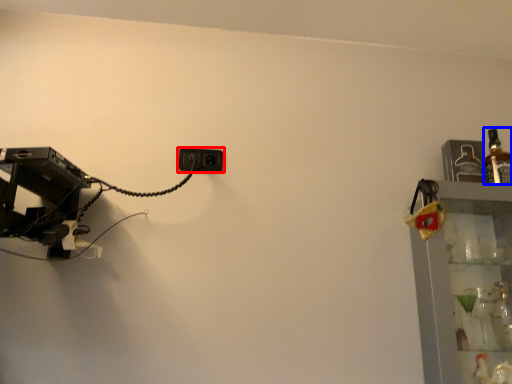
Question: Which point is closer to the camera, power plugs and sockets (highlighted by a red box) or bottle (highlighted by a blue box)?

Choices:
 (A) power plugs and sockets
 (B) bottle

Answer: (B)